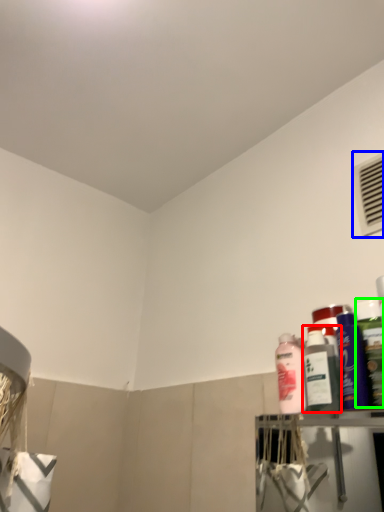
Question: Which object is positioned closest to bottle (highlighted by a red box)? Select from air conditioning (highlighted by a blue box) and cleaning product (highlighted by a green box).

Choices:
 (A) air conditioning
 (B) cleaning product

Answer: (B)